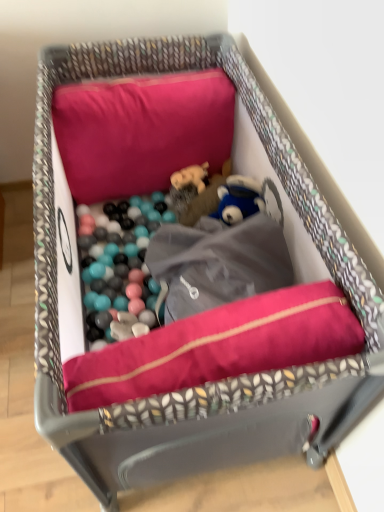
Question: In the image, is velvet-like pink cushion at center positioned in front of or behind matte pink pillow at upper center?

Choices:
 (A) front
 (B) behind

Answer: (A)

Question: Looking at the image, does velvet-like pink cushion at center seem bigger or smaller compared to matte pink pillow at upper center?

Choices:
 (A) big
 (B) small

Answer: (B)

Question: Considering the positions of point (167, 348) and point (200, 160), is point (167, 348) closer or farther from the camera than point (200, 160)?

Choices:
 (A) closer
 (B) farther

Answer: (A)

Question: Is matte pink pillow at upper center inside or outside of velvet-like pink cushion at center?

Choices:
 (A) inside
 (B) outside

Answer: (B)

Question: Considering the relative positions of matte pink pillow at upper center and velvet-like pink cushion at center in the image provided, is matte pink pillow at upper center to the left or to the right of velvet-like pink cushion at center?

Choices:
 (A) right
 (B) left

Answer: (B)

Question: In terms of width, does matte pink pillow at upper center look wider or thinner when compared to velvet-like pink cushion at center?

Choices:
 (A) wide
 (B) thin

Answer: (A)

Question: Is matte pink pillow at upper center bigger or smaller than velvet-like pink cushion at center?

Choices:
 (A) small
 (B) big

Answer: (B)